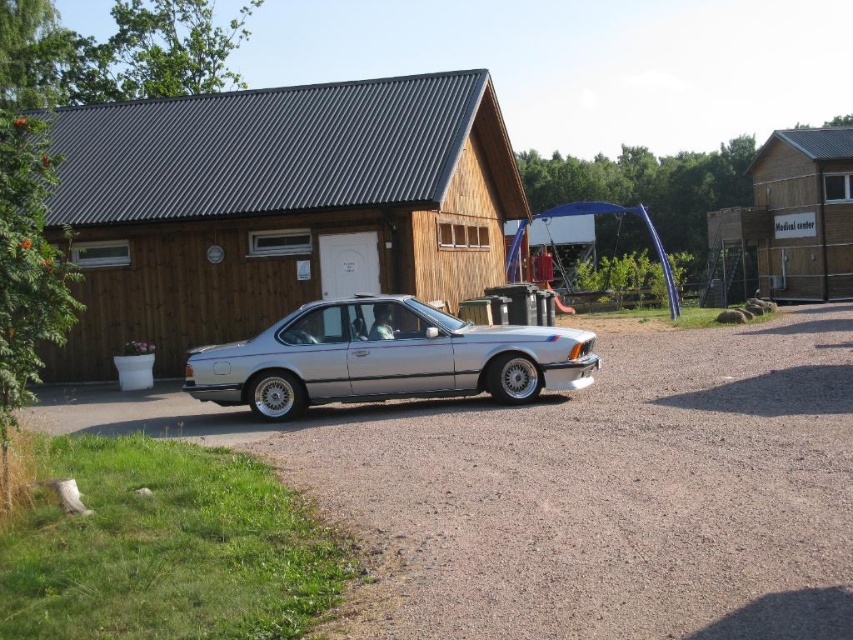
Which is in front, point (361, 508) or point (486, 336)?

Point (361, 508) is more forward.

This screenshot has width=853, height=640. What do you see at coordinates (608, 493) in the screenshot?
I see `silver metallic gravel at center` at bounding box center [608, 493].

I want to click on silver metallic gravel at center, so click(x=608, y=493).